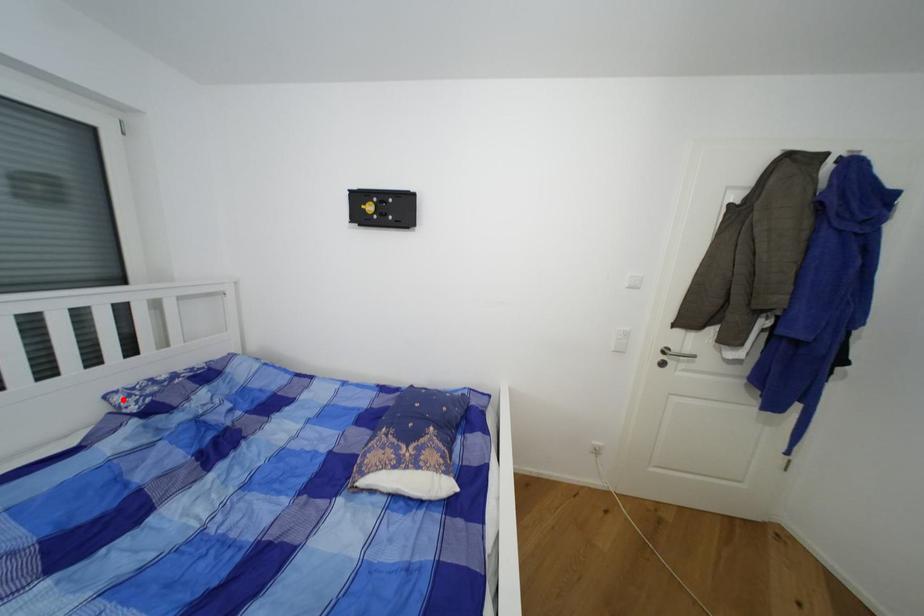
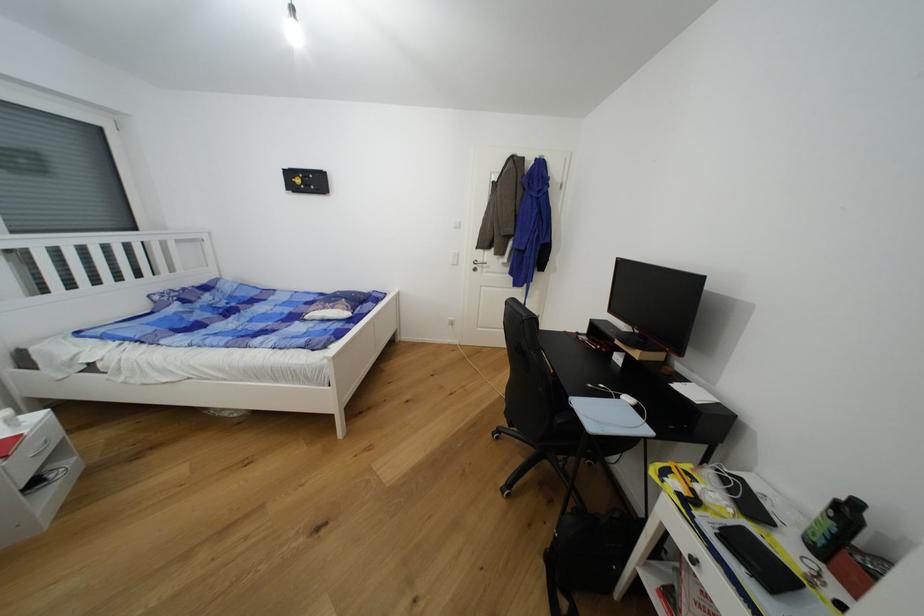
Where in the second image is the point corresponding to the highlighted location from the first image?

(162, 299)